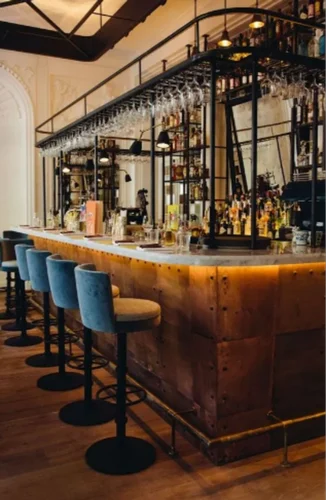
The image size is (326, 500). What are the coordinates of `barstools` in the screenshot? It's located at (94, 307), (67, 289), (39, 277), (25, 264), (12, 248), (10, 231).